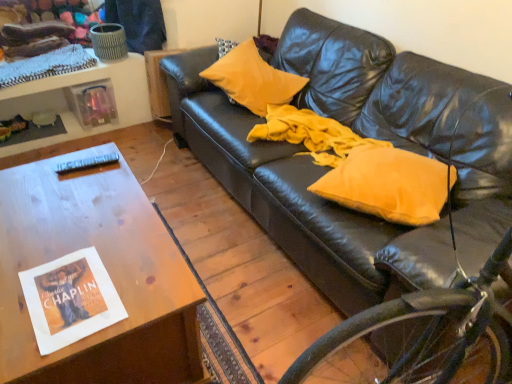
The width and height of the screenshot is (512, 384). In order to click on free area in between black plastic remote control at upper left and white paper magazine at lower left in this screenshot , I will do `click(80, 214)`.